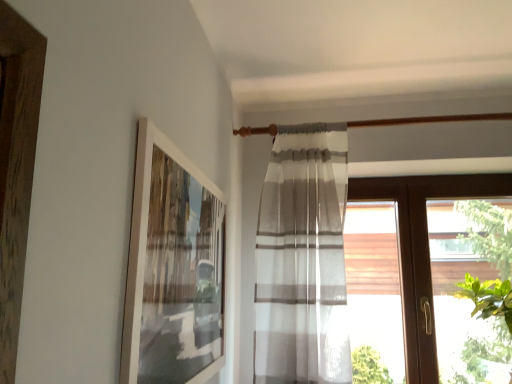
Question: From the image's perspective, relative to green leafy plant at right, is brown wood window at right above or below?

Choices:
 (A) above
 (B) below

Answer: (A)

Question: Looking at their shapes, would you say brown wood window at right is wider or thinner than green leafy plant at right?

Choices:
 (A) thin
 (B) wide

Answer: (A)

Question: Which object is the closest to the white matte picture frame at upper left?

Choices:
 (A) green leafy plant at right
 (B) brown wood window at right
 (C) white sheer curtain at center

Answer: (C)

Question: Estimate the real-world distances between objects in this image. Which object is farther from the green leafy plant at right?

Choices:
 (A) brown wood window at right
 (B) white matte picture frame at upper left
 (C) white sheer curtain at center

Answer: (B)